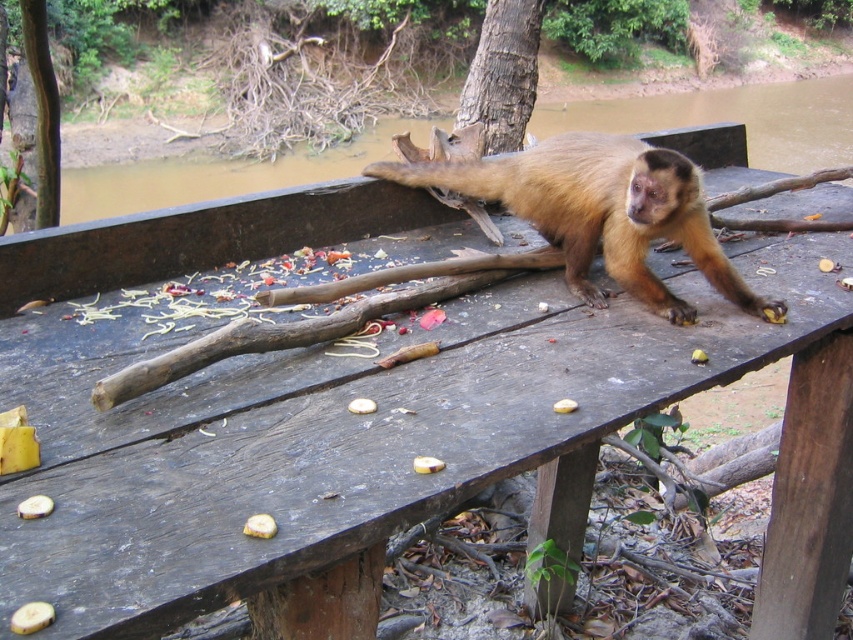
Question: Can you confirm if brown rough bark tree at upper center is bigger than yellow matte fruit at lower left?

Choices:
 (A) yes
 (B) no

Answer: (A)

Question: In this image, where is brown rough bark tree at upper center located relative to yellow matte fruit at lower left?

Choices:
 (A) right
 (B) left

Answer: (A)

Question: Can you confirm if yellow matte fruit at center is thinner than yellow rubber fruit at center?

Choices:
 (A) yes
 (B) no

Answer: (B)

Question: Which of the following is the closest to the observer?

Choices:
 (A) (39, 515)
 (B) (509, 122)
 (C) (22, 618)
 (D) (431, 470)

Answer: (C)

Question: Which of the following is the farthest from the observer?

Choices:
 (A) brown furry monkey at center
 (B) yellow matte fruit at lower left

Answer: (A)

Question: Which point appears closest to the camera in this image?

Choices:
 (A) (30, 509)
 (B) (33, 602)

Answer: (B)